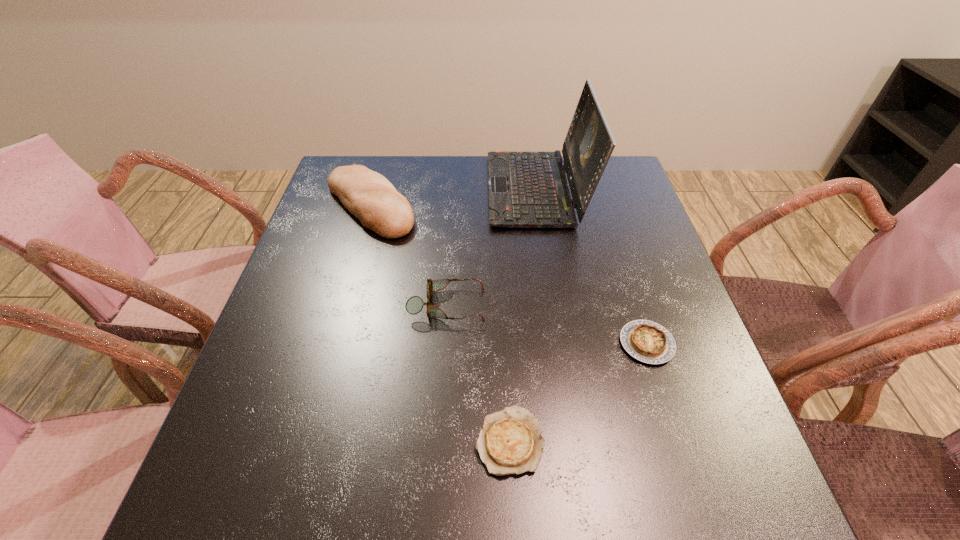
Where is `quiche positioned at the right edge`? The image size is (960, 540). quiche positioned at the right edge is located at coordinates (646, 341).

Where is `object that is at the far left corner`? This screenshot has width=960, height=540. object that is at the far left corner is located at coordinates (369, 196).

You are a GUI agent. You are given a task and a screenshot of the screen. Output one action in this format:
    pyautogui.click(x=<x>, y=<y>)
    Task: Click on the object present at the far right corner
    
    Given the screenshot: What is the action you would take?
    pyautogui.click(x=526, y=189)

This screenshot has width=960, height=540. What are the coordinates of `free space at the far edge of the desktop` in the screenshot? It's located at (472, 170).

Identify the location of free point at the near edge. (603, 507).

Identify the location of vacant space at the left edge of the desktop. This screenshot has width=960, height=540. (354, 234).

In the image, there is a desktop. Identify the location of free space at the right edge. Image resolution: width=960 pixels, height=540 pixels. (670, 463).

Where is `vacant area that lies between the laptop computer and the nearer quiche`? vacant area that lies between the laptop computer and the nearer quiche is located at coordinates (523, 315).

The width and height of the screenshot is (960, 540). What are the coordinates of `free point between the laptop computer and the second shortest object` in the screenshot? It's located at (591, 267).

This screenshot has height=540, width=960. In order to click on free spot between the farther quiche and the third tallest object in this screenshot , I will do `click(547, 324)`.